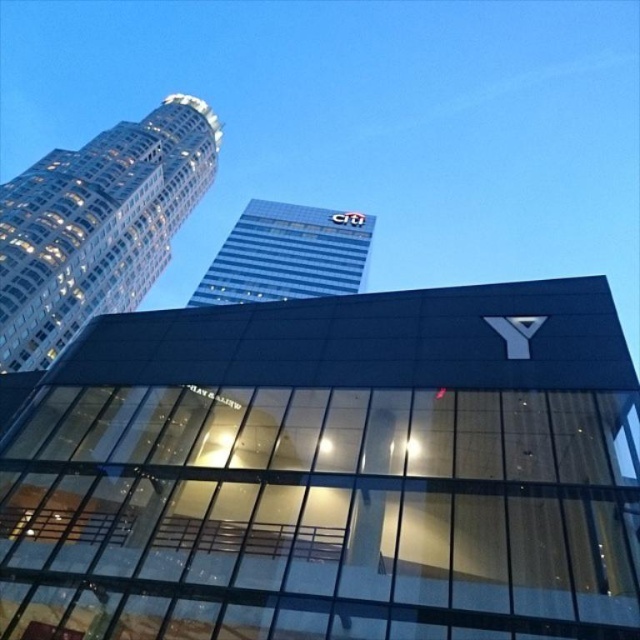
Question: Among these points, which one is nearest to the camera?

Choices:
 (A) (177, 218)
 (B) (360, 248)

Answer: (B)

Question: Does white glass skyscraper at upper left have a lesser width compared to blue glass building at upper center?

Choices:
 (A) no
 (B) yes

Answer: (B)

Question: Is white glass skyscraper at upper left further to the viewer compared to blue glass building at upper center?

Choices:
 (A) yes
 (B) no

Answer: (B)

Question: Is white glass skyscraper at upper left smaller than blue glass building at upper center?

Choices:
 (A) yes
 (B) no

Answer: (B)

Question: Which point is farther to the camera?

Choices:
 (A) white glass skyscraper at upper left
 (B) blue glass building at upper center

Answer: (B)

Question: Among these points, which one is farthest from the camera?

Choices:
 (A) (225, 294)
 (B) (42, 368)

Answer: (A)